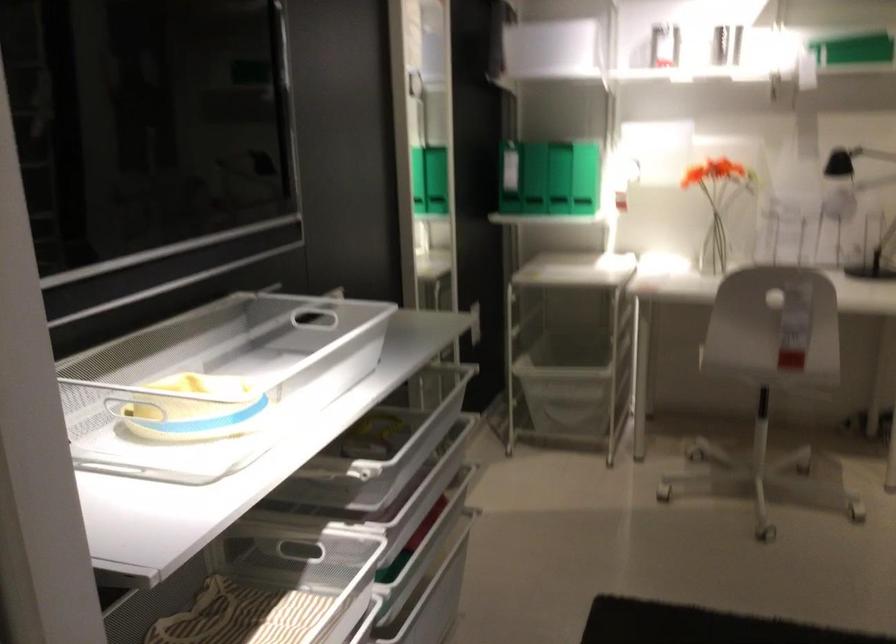
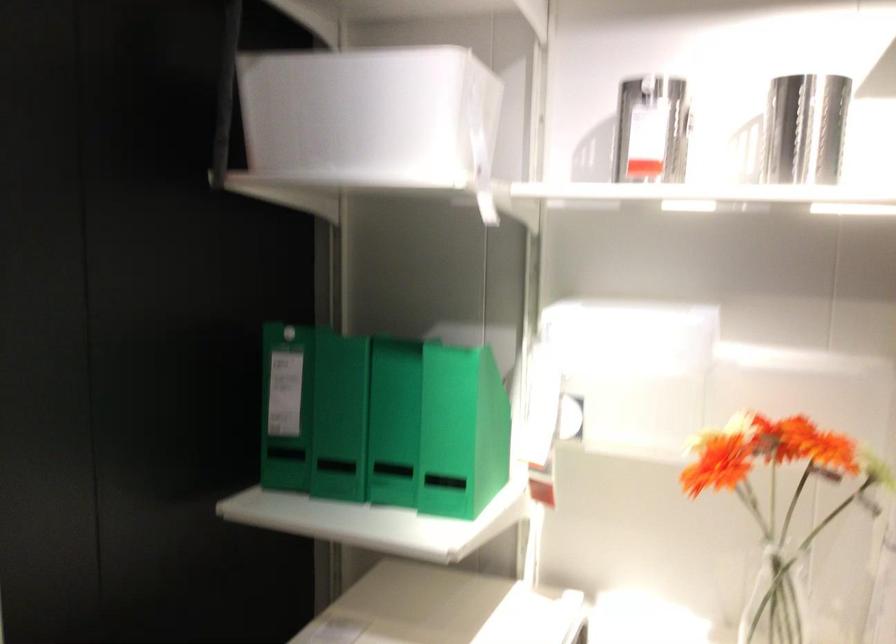
Locate, in the second image, the point that corresponds to point (540, 169) in the first image.

(339, 417)